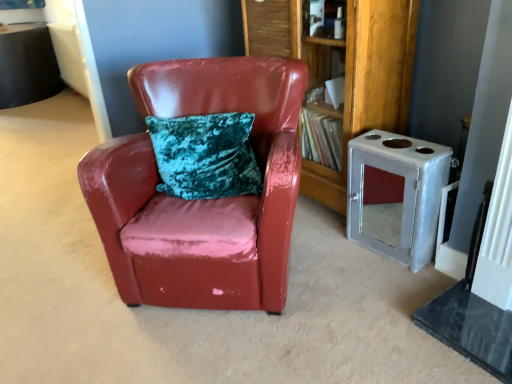
What do you see at coordinates (396, 195) in the screenshot?
I see `metallic silver cabinet at right` at bounding box center [396, 195].

What is the approximate height of glossy leather chair at center?

It is 33.59 inches.

The image size is (512, 384). What do you see at coordinates (345, 70) in the screenshot?
I see `wooden bookshelf at center` at bounding box center [345, 70].

Where is `metallic silver cabinet at right`? The height and width of the screenshot is (384, 512). metallic silver cabinet at right is located at coordinates (396, 195).

Is wooden bookshelf at center looking in the opposite direction of metallic silver cabinet at right?

wooden bookshelf at center is not turned away from metallic silver cabinet at right.

Considering the sizes of objects wooden bookshelf at center and metallic silver cabinet at right in the image provided, who is smaller, wooden bookshelf at center or metallic silver cabinet at right?

metallic silver cabinet at right is smaller.

Is point (416, 2) positioned in front of point (357, 184)?

That is False.

Is metallic silver cabinet at right smaller than glossy leather chair at center?

Correct, metallic silver cabinet at right occupies less space than glossy leather chair at center.

Which object is thinner, metallic silver cabinet at right or glossy leather chair at center?

metallic silver cabinet at right is thinner.

Considering the positions of point (393, 244) and point (280, 274), is point (393, 244) closer or farther from the camera than point (280, 274)?

Clearly, point (393, 244) is more distant from the camera than point (280, 274).

From a real-world perspective, relative to glossy leather chair at center, is metallic silver cabinet at right vertically above or below?

metallic silver cabinet at right is below glossy leather chair at center.

Can you confirm if wooden bookshelf at center is bigger than glossy leather chair at center?

Actually, wooden bookshelf at center might be smaller than glossy leather chair at center.

Is wooden bookshelf at center next to glossy leather chair at center?

No, wooden bookshelf at center is not next to glossy leather chair at center.

Consider the image. Which is more to the right, wooden bookshelf at center or glossy leather chair at center?

From the viewer's perspective, wooden bookshelf at center appears more on the right side.

Measure the distance between wooden bookshelf at center and glossy leather chair at center.

59.41 centimeters.

Between glossy leather chair at center and wooden bookshelf at center, which one has smaller size?

wooden bookshelf at center.

Which object is wider, glossy leather chair at center or wooden bookshelf at center?

With larger width is glossy leather chair at center.

Who is more distant, glossy leather chair at center or wooden bookshelf at center?

wooden bookshelf at center.

Considering the relative positions of glossy leather chair at center and wooden bookshelf at center in the image provided, is glossy leather chair at center to the right of wooden bookshelf at center from the viewer's perspective?

No.

Considering the sizes of objects metallic silver cabinet at right and wooden bookshelf at center in the image provided, who is smaller, metallic silver cabinet at right or wooden bookshelf at center?

metallic silver cabinet at right is smaller.

Identify the location of appliance that appears below the wooden bookshelf at center (from a real-world perspective). The width and height of the screenshot is (512, 384). (396, 195).

Considering the positions of objects metallic silver cabinet at right and wooden bookshelf at center in the image provided, who is behind, metallic silver cabinet at right or wooden bookshelf at center?

wooden bookshelf at center is more distant.

Considering the relative sizes of metallic silver cabinet at right and wooden bookshelf at center in the image provided, is metallic silver cabinet at right shorter than wooden bookshelf at center?

Correct, metallic silver cabinet at right is not as tall as wooden bookshelf at center.

Is metallic silver cabinet at right at the back of glossy leather chair at center?

glossy leather chair at center is not turned away from metallic silver cabinet at right.

In the scene shown: Is glossy leather chair at center completely or partially outside of metallic silver cabinet at right?

Indeed, glossy leather chair at center is completely outside metallic silver cabinet at right.

Is glossy leather chair at center wider than metallic silver cabinet at right?

Yes.

Is the position of glossy leather chair at center more distant than that of metallic silver cabinet at right?

No, glossy leather chair at center is closer to the viewer.

The image size is (512, 384). Identify the location of appliance beneath the wooden bookshelf at center (from a real-world perspective). (396, 195).

Find the location of a particular element. chair in front of the metallic silver cabinet at right is located at coordinates (202, 200).

Considering their positions, is metallic silver cabinet at right positioned closer to glossy leather chair at center than wooden bookshelf at center?

The object closer to glossy leather chair at center is wooden bookshelf at center.

Based on the photo, which object lies nearer to the anchor point wooden bookshelf at center, glossy leather chair at center or metallic silver cabinet at right?

metallic silver cabinet at right lies closer to wooden bookshelf at center than the other object.

Looking at the image, which one is located further to metallic silver cabinet at right, glossy leather chair at center or wooden bookshelf at center?

The object further to metallic silver cabinet at right is glossy leather chair at center.

Based on their spatial positions, is wooden bookshelf at center or glossy leather chair at center further from metallic silver cabinet at right?

glossy leather chair at center is positioned further to the anchor metallic silver cabinet at right.

Which object lies nearer to the anchor point glossy leather chair at center, wooden bookshelf at center or metallic silver cabinet at right?

wooden bookshelf at center is closer to glossy leather chair at center.

When comparing their distances from wooden bookshelf at center, does metallic silver cabinet at right or glossy leather chair at center seem closer?

The object closer to wooden bookshelf at center is metallic silver cabinet at right.

This screenshot has width=512, height=384. Find the location of `bookshelf between glossy leather chair at center and metallic silver cabinet at right from left to right`. bookshelf between glossy leather chair at center and metallic silver cabinet at right from left to right is located at coordinates (345, 70).